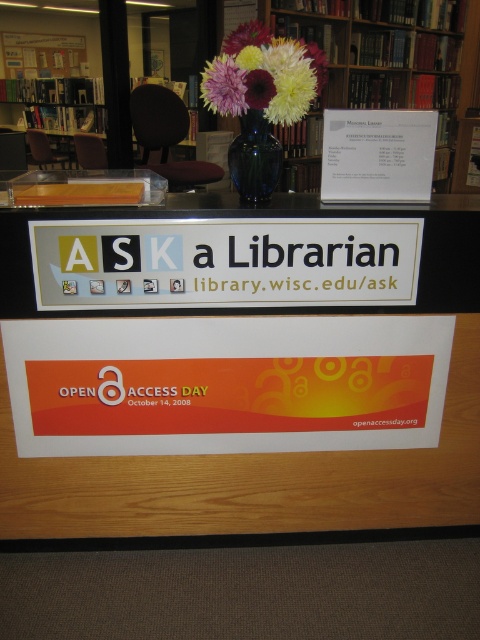
Who is more forward, (317, 54) or (231, 56)?

Positioned in front is point (231, 56).

Is fluffy silk flowers at center smaller than vibrant purple flower at center?

No, fluffy silk flowers at center is not smaller than vibrant purple flower at center.

The height and width of the screenshot is (640, 480). I want to click on fluffy silk flowers at center, so click(x=264, y=74).

Is point (222, 97) behind point (237, 42)?

No.

Which of these two, vibrant purple flower at center or pastel floral bouquet at center, stands shorter?

pastel floral bouquet at center is shorter.

Image resolution: width=480 pixels, height=640 pixels. Describe the element at coordinates (224, 84) in the screenshot. I see `vibrant purple flower at center` at that location.

The image size is (480, 640). I want to click on vibrant purple flower at center, so click(224, 84).

In the scene shown: Who is positioned more to the right, wooden bookshelf at upper center or blue glass vase at center?

Positioned to the right is wooden bookshelf at upper center.

Which is more to the left, wooden bookshelf at upper center or blue glass vase at center?

blue glass vase at center is more to the left.

Between point (362, 106) and point (241, 177), which one is positioned in front?

Point (241, 177) is in front.

Identify the location of wooden bookshelf at upper center. (391, 54).